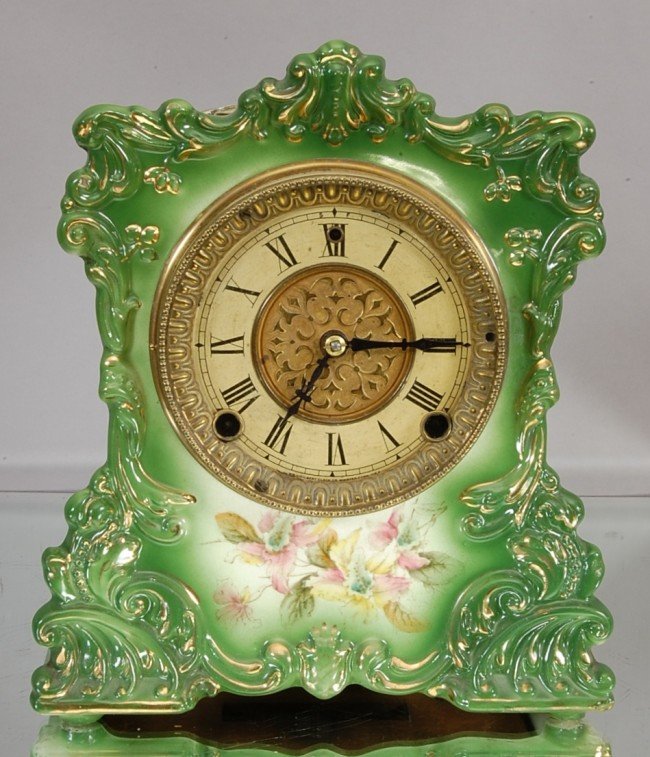
Where is `wall`? This screenshot has width=650, height=757. wall is located at coordinates (190, 51).